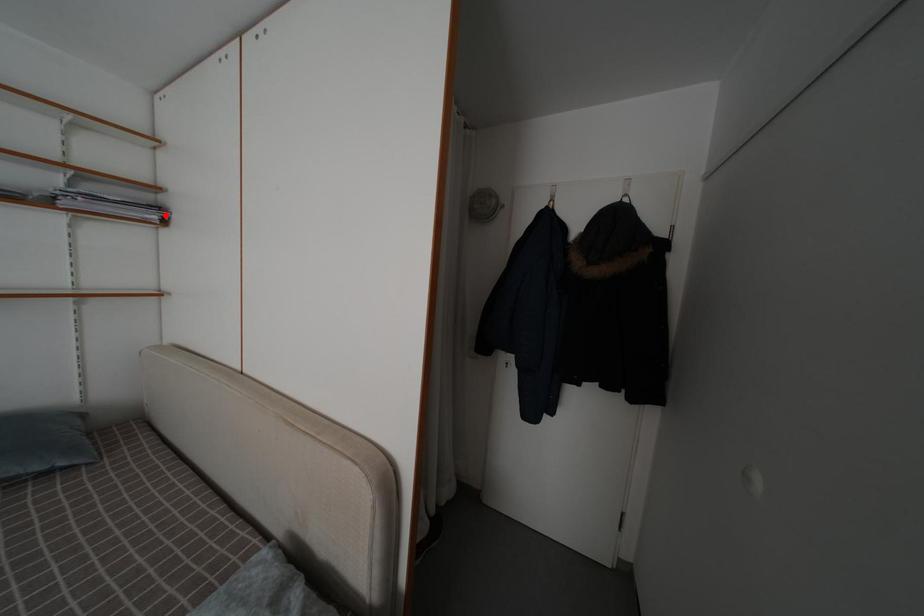
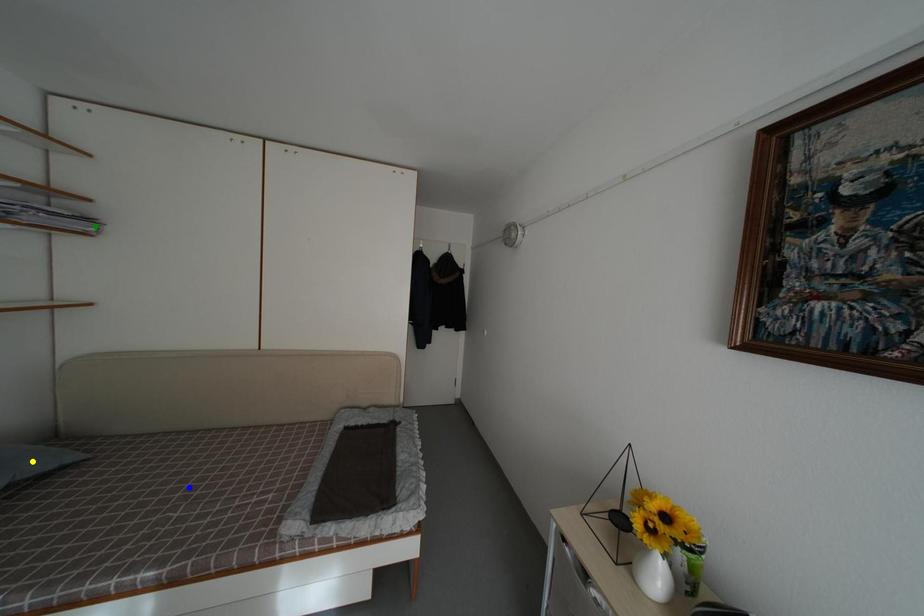
Question: I am providing you with two images of the same scene from different viewpoints. A red point is marked on the first image. You are given multiple points on the second image. In image 2, which mark is for the same physical point as the one in image 1?

Choices:
 (A) yellow point
 (B) blue point
 (C) green point

Answer: (C)